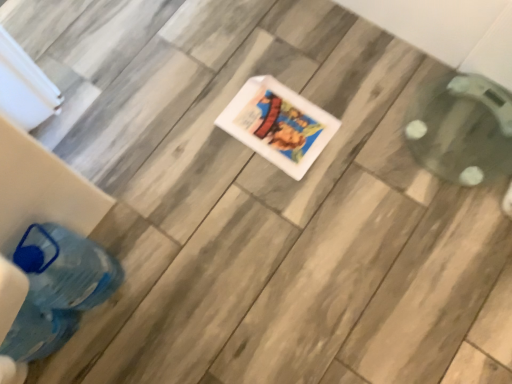
Identify the location of unoccupied area in front of blue plastic bottle at lower left. The height and width of the screenshot is (384, 512). (121, 350).